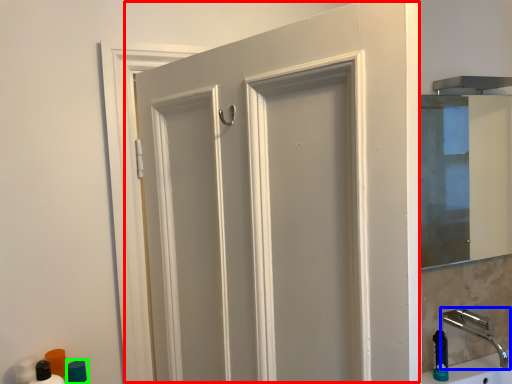
Question: Which object is the closest to the door (highlighted by a red box)? Choose among these: tap (highlighted by a blue box) or toiletry (highlighted by a green box).

Choices:
 (A) tap
 (B) toiletry

Answer: (B)